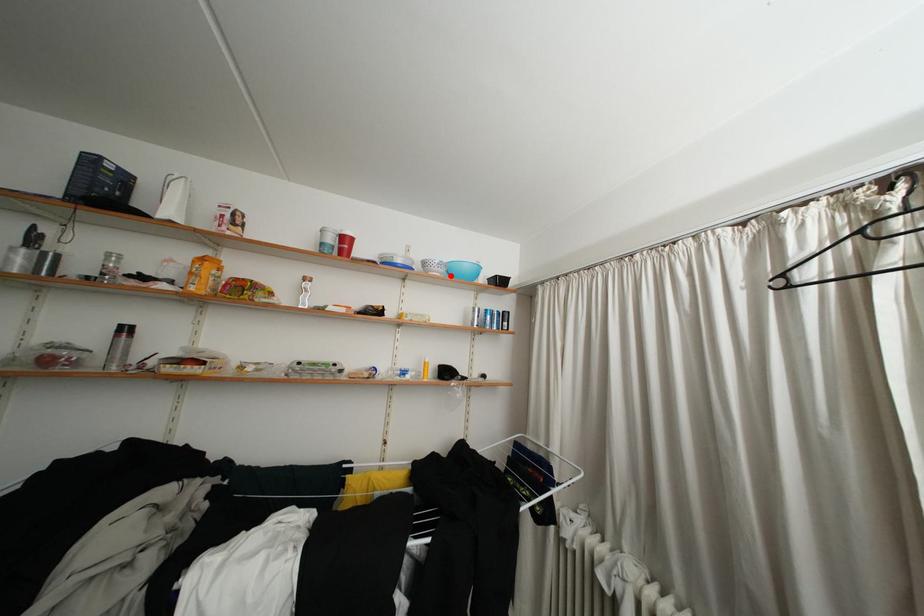
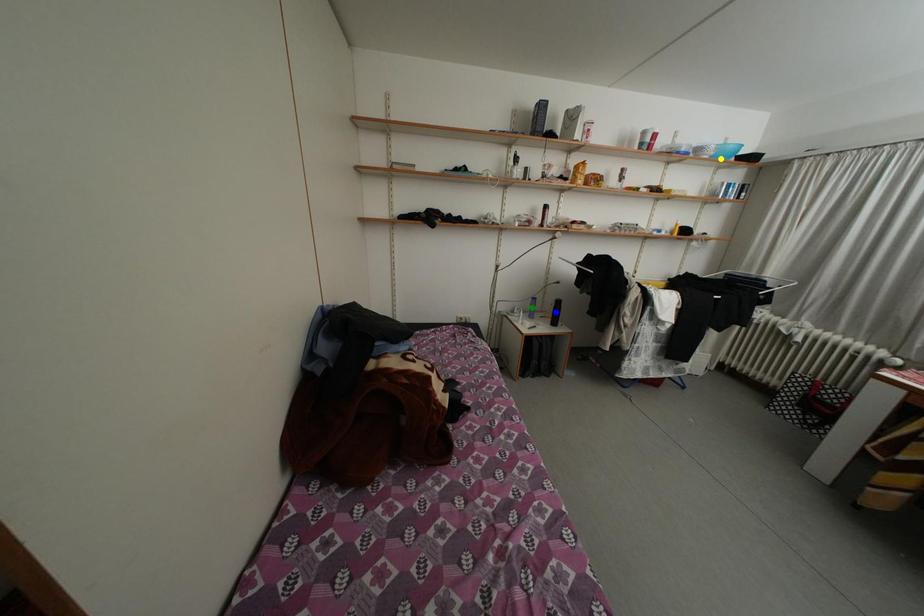
Question: I am providing you with two images of the same scene from different viewpoints. A red point is marked on the first image. You are given multiple points on the second image. Which point in image 2 represents the same 3d spot as the red point in image 1?

Choices:
 (A) blue point
 (B) yellow point
 (C) green point

Answer: (B)